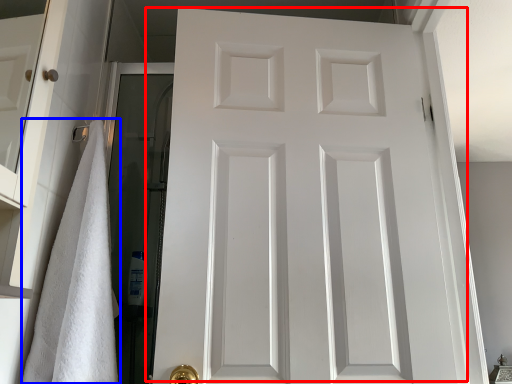
Question: Which object is further to the camera taking this photo, door (highlighted by a red box) or bath towel (highlighted by a blue box)?

Choices:
 (A) door
 (B) bath towel

Answer: (A)